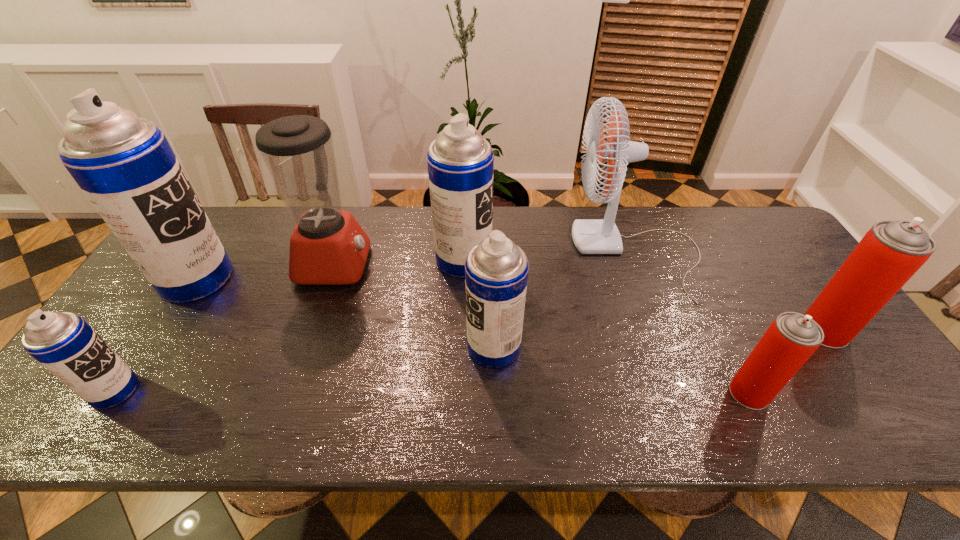
Find the location of a particular element. The height and width of the screenshot is (540, 960). empty location between the third biggest blue aerosol can and the left red aerosol can is located at coordinates (621, 370).

The width and height of the screenshot is (960, 540). Identify the location of object that is the fourth closest one to the biggest blue aerosol can. (496, 270).

At what (x,y) coordinates should I click in order to perform the action: click on object that can be found as the fourth closest to the third biggest blue aerosol can. Please return your answer as a coordinate pair (x, y). Image resolution: width=960 pixels, height=540 pixels. Looking at the image, I should click on (791, 339).

Find the location of a particular element. This screenshot has height=540, width=960. the sixth closest aerosol can to the third object from left to right is located at coordinates (891, 252).

Point out which aerosol can is positioned as the third nearest to the nearest blue aerosol can. Please provide its 2D coordinates. Your answer should be formatted as a tuple, i.e. [(x, y)], where the tuple contains the x and y coordinates of a point satisfying the conditions above.

[(496, 270)]

I want to click on blue aerosol can that is the closest to the fan, so click(496, 270).

At what (x,y) coordinates should I click in order to perform the action: click on blue aerosol can that is the third closest to the biggest blue aerosol can. Please return your answer as a coordinate pair (x, y). The width and height of the screenshot is (960, 540). Looking at the image, I should click on click(496, 270).

What are the coordinates of `free space that satisfies the following two spatial constraints: 1. on the label side of the nearest blue aerosol can; 2. on the left side of the smaller red aerosol can` in the screenshot? It's located at (112, 393).

Identify the location of vacant area in the image that satisfies the following two spatial constraints: 1. on the back side of the farther red aerosol can; 2. on the front-facing side of the fan. (771, 254).

Locate an element on the screen. The width and height of the screenshot is (960, 540). free region that satisfies the following two spatial constraints: 1. on the label side of the smaller red aerosol can; 2. on the right side of the second smallest blue aerosol can is located at coordinates (495, 393).